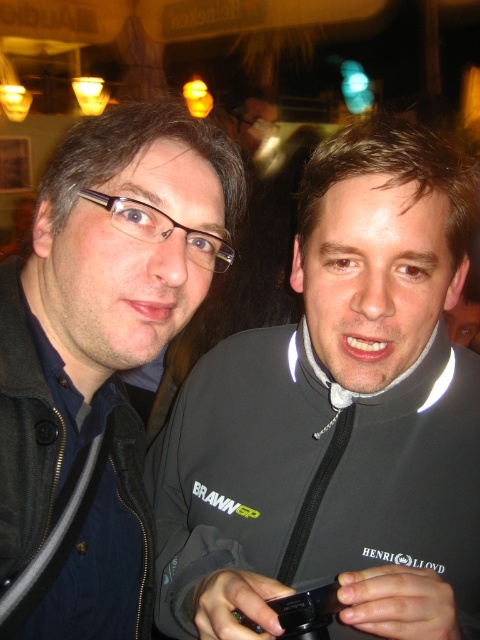
Does black matte jacket at center have a lesser width compared to black plastic smartphone at center?

No.

Is black matte jacket at center wider than black plastic smartphone at center?

Yes, black matte jacket at center is wider than black plastic smartphone at center.

Where is `black matte jacket at center`? The height and width of the screenshot is (640, 480). black matte jacket at center is located at coordinates (336, 417).

Does matte black jacket at left have a lesser height compared to black plastic smartphone at center?

No.

Is point (93, 608) positioned behind point (325, 624)?

Yes.

Who is more distant from viewer, (24, 428) or (301, 625)?

The point (24, 428) is behind.

The image size is (480, 640). Identify the location of matte black jacket at left. (100, 353).

Can you confirm if black matte jacket at center is positioned to the right of matte black jacket at left?

Correct, you'll find black matte jacket at center to the right of matte black jacket at left.

Identify the location of black matte jacket at center. The image size is (480, 640). (336, 417).

The height and width of the screenshot is (640, 480). In order to click on black matte jacket at center in this screenshot , I will do pyautogui.click(x=336, y=417).